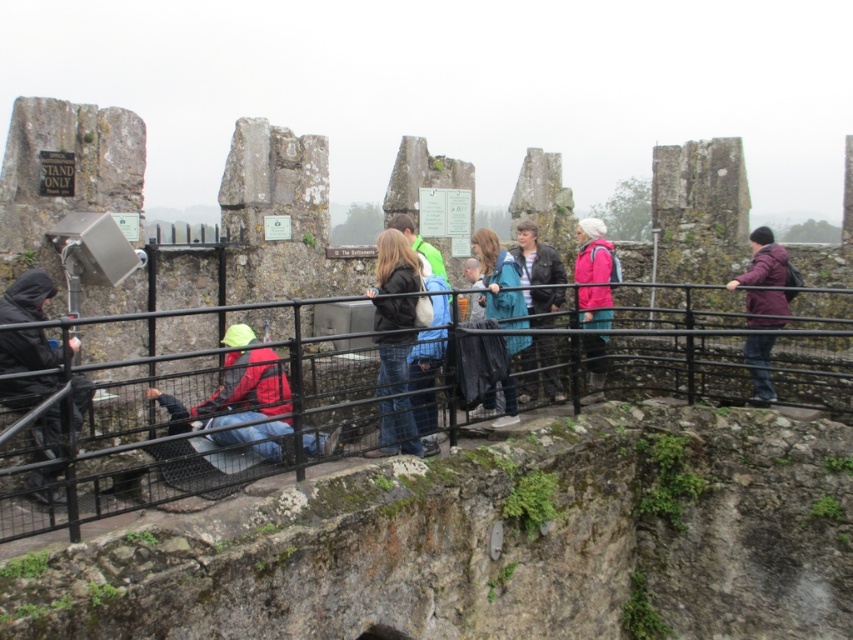
Question: Considering the relative positions of dark gray jacket at left and pink matte jacket at center in the image provided, where is dark gray jacket at left located with respect to pink matte jacket at center?

Choices:
 (A) right
 (B) left

Answer: (B)

Question: Which is nearer to the teal fabric jacket at center?

Choices:
 (A) black metal fence at lower left
 (B) red jacket at center
 (C) pink matte jacket at center

Answer: (C)

Question: Is black metal fence at lower left to the left of leather jacket at center from the viewer's perspective?

Choices:
 (A) no
 (B) yes

Answer: (B)

Question: Which point is closer to the camera?

Choices:
 (A) (260, 429)
 (B) (769, 324)

Answer: (A)

Question: Among these points, which one is nearest to the camera?

Choices:
 (A) (215, 492)
 (B) (409, 342)
 (C) (233, 436)
 (D) (485, 403)

Answer: (A)

Question: Can you confirm if dark gray jacket at left is wider than pink matte jacket at center?

Choices:
 (A) yes
 (B) no

Answer: (B)